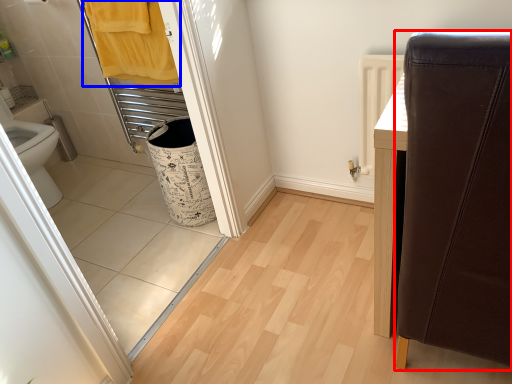
Question: Which of the following is the closest to the observer, furniture (highlighted by a red box) or bath towel (highlighted by a blue box)?

Choices:
 (A) furniture
 (B) bath towel

Answer: (A)